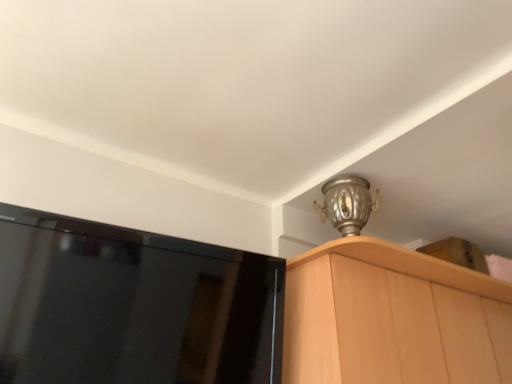
Question: Visually, is black glossy screen at upper left positioned to the left or to the right of light wood cabinet at upper right?

Choices:
 (A) left
 (B) right

Answer: (A)

Question: In terms of width, does black glossy screen at upper left look wider or thinner when compared to light wood cabinet at upper right?

Choices:
 (A) thin
 (B) wide

Answer: (A)

Question: Considering the positions of point (231, 336) and point (394, 291), is point (231, 336) closer or farther from the camera than point (394, 291)?

Choices:
 (A) closer
 (B) farther

Answer: (A)

Question: From a real-world perspective, relative to black glossy screen at upper left, is light wood cabinet at upper right vertically above or below?

Choices:
 (A) below
 (B) above

Answer: (B)

Question: Is light wood cabinet at upper right taller or shorter than black glossy screen at upper left?

Choices:
 (A) tall
 (B) short

Answer: (A)

Question: Is light wood cabinet at upper right wider or thinner than black glossy screen at upper left?

Choices:
 (A) thin
 (B) wide

Answer: (B)

Question: Based on their sizes in the image, would you say light wood cabinet at upper right is bigger or smaller than black glossy screen at upper left?

Choices:
 (A) small
 (B) big

Answer: (B)